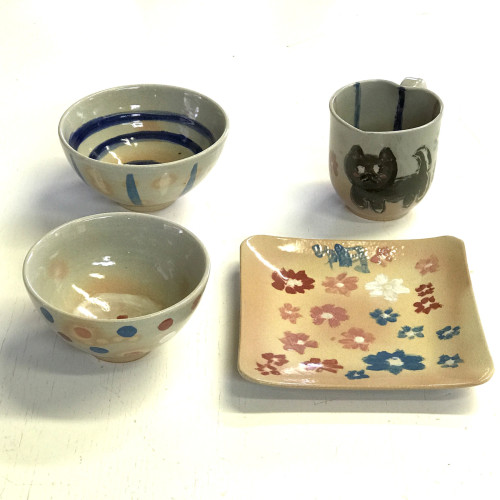
Image resolution: width=500 pixels, height=500 pixels. I want to click on plate, so [x=358, y=306].